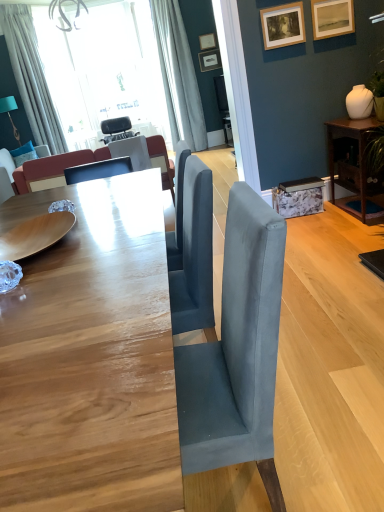
Question: Should I look upward or downward to see smooth wooden table at center, placed as the 2th table when sorted from back to front?

Choices:
 (A) down
 (B) up

Answer: (A)

Question: Can you confirm if wooden picture frame at upper center, positioned as the 1th picture frame in bottom-to-top order, is positioned to the right of matte white picture frame at upper center, acting as the third picture frame starting from the front?

Choices:
 (A) yes
 (B) no

Answer: (A)

Question: From a real-world perspective, is wooden picture frame at upper center, marked as the first picture frame in a front-to-back arrangement, over matte white picture frame at upper center, placed as the second picture frame when sorted from back to front?

Choices:
 (A) yes
 (B) no

Answer: (B)

Question: Is the surface of wooden picture frame at upper center, the 4th picture frame from the back, in direct contact with matte white picture frame at upper center, acting as the third picture frame starting from the front?

Choices:
 (A) yes
 (B) no

Answer: (B)

Question: Is wooden picture frame at upper center, marked as the first picture frame in a front-to-back arrangement, far from matte white picture frame at upper center, acting as the third picture frame starting from the front?

Choices:
 (A) no
 (B) yes

Answer: (B)

Question: Is wooden picture frame at upper center, positioned as the fourth picture frame in top-to-bottom order, bigger than matte white picture frame at upper center, placed as the second picture frame when sorted from back to front?

Choices:
 (A) yes
 (B) no

Answer: (B)

Question: From the image's perspective, does wooden picture frame at upper center, positioned as the fourth picture frame in top-to-bottom order, appear lower than matte white picture frame at upper center, marked as the fourth picture frame in a bottom-to-top arrangement?

Choices:
 (A) no
 (B) yes

Answer: (B)

Question: Is matte white picture frame at upper center, acting as the third picture frame starting from the front, placed right next to brown wood table at right, the 2th table when ordered from left to right?

Choices:
 (A) yes
 (B) no

Answer: (B)

Question: Is matte white picture frame at upper center, placed as the second picture frame when sorted from back to front, at the right side of brown wood table at right, which is the second table from front to back?

Choices:
 (A) no
 (B) yes

Answer: (A)

Question: Could you tell me if matte white picture frame at upper center, acting as the third picture frame starting from the front, is facing brown wood table at right, the 2th table when ordered from left to right?

Choices:
 (A) no
 (B) yes

Answer: (B)

Question: Is matte white picture frame at upper center, placed as the second picture frame when sorted from back to front, completely or partially outside of brown wood table at right, the 2th table when ordered from left to right?

Choices:
 (A) no
 (B) yes

Answer: (B)

Question: Does matte white picture frame at upper center, acting as the third picture frame starting from the front, have a greater width compared to brown wood table at right, which ranks as the 1th table in top-to-bottom order?

Choices:
 (A) no
 (B) yes

Answer: (A)

Question: Can you confirm if matte white picture frame at upper center, placed as the second picture frame when sorted from back to front, is taller than brown wood table at right, which ranks as the 1th table in top-to-bottom order?

Choices:
 (A) no
 (B) yes

Answer: (A)

Question: Considering the relative sizes of matte black picture frame at upper center, which ranks as the 2th picture frame in top-to-bottom order, and white fabric curtain at upper center, which ranks as the 2th curtain in left-to-right order, in the image provided, is matte black picture frame at upper center, which ranks as the 2th picture frame in top-to-bottom order, taller than white fabric curtain at upper center, which ranks as the 2th curtain in left-to-right order,?

Choices:
 (A) no
 (B) yes

Answer: (A)